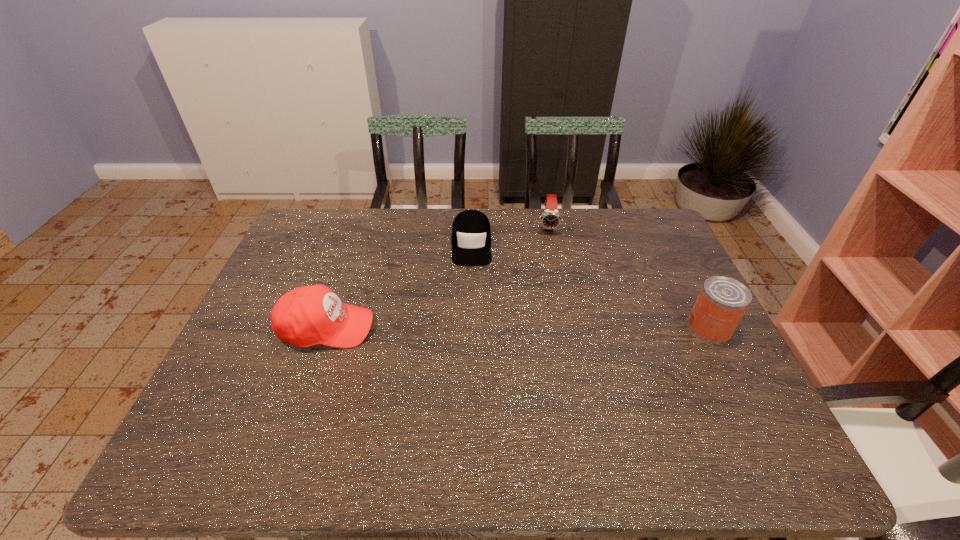
This screenshot has height=540, width=960. I want to click on baseball cap, so click(x=305, y=316).

You are a GUI agent. You are given a task and a screenshot of the screen. Output one action in this format:
    pyautogui.click(x=<x>, y=<y>)
    Task: Click on the can
    The width and height of the screenshot is (960, 540).
    Given the screenshot: What is the action you would take?
    pyautogui.click(x=722, y=301)

At what (x,y) coordinates should I click in order to perform the action: click on the second object from right to left. Please return your answer as a coordinate pair (x, y). Looking at the image, I should click on (550, 219).

Identify the location of the shortest object. (471, 235).

Identify the location of cap. (471, 235).

The image size is (960, 540). What are the coordinates of `free space located on the front panel of the baseball cap` in the screenshot? It's located at (472, 328).

Where is `vacant space located 0.210m on the front of the rightmost object`? Image resolution: width=960 pixels, height=540 pixels. vacant space located 0.210m on the front of the rightmost object is located at coordinates (756, 418).

I want to click on vacant area situated 0.250m on the face of the watch, so click(x=551, y=287).

Find the location of a particular element. The image size is (960, 540). vacant area located 0.360m on the face of the watch is located at coordinates (552, 315).

In order to click on free point located on the face of the watch in this screenshot , I will do `click(551, 302)`.